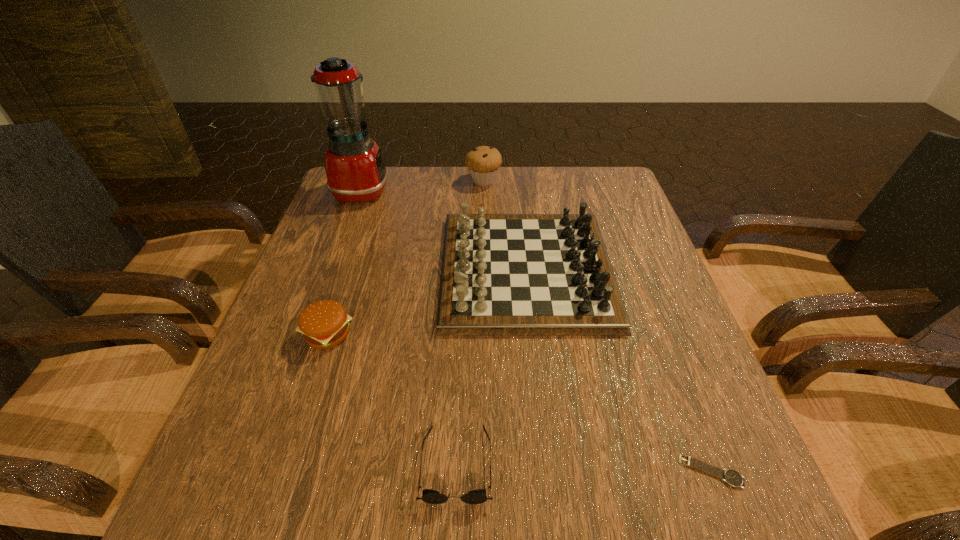
This screenshot has width=960, height=540. I want to click on food processor, so click(x=355, y=170).

This screenshot has height=540, width=960. I want to click on muffin, so click(x=483, y=162).

The height and width of the screenshot is (540, 960). I want to click on chessboard, so click(x=502, y=274).

Identify the location of the fourth tallest object. (324, 324).

Find the location of a particular element. sunglasses is located at coordinates pyautogui.click(x=478, y=496).

The width and height of the screenshot is (960, 540). What are the coordinates of `watch` in the screenshot? It's located at (730, 476).

Locate an element on the screen. the shortest object is located at coordinates (730, 476).

The image size is (960, 540). Identify the location of vacant space located 0.270m on the controls of the tallest object. (480, 191).

I want to click on vacant region located on the left of the muffin, so click(430, 180).

In order to click on vacant region located from the player's perspective of the chessboard in this screenshot , I will do `click(371, 270)`.